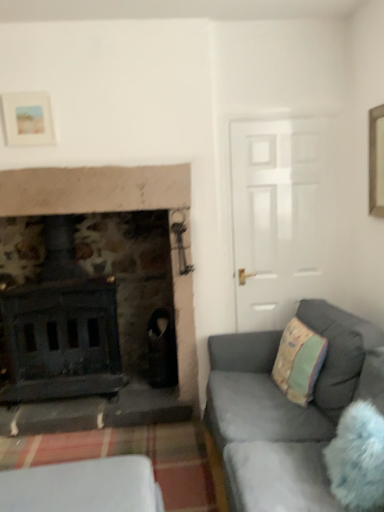
Where is `matte white picture frame at upper left`? This screenshot has width=384, height=512. matte white picture frame at upper left is located at coordinates [27, 119].

What is the approximate width of velvet grey couch at lower right?

It is 86.02 centimeters.

This screenshot has height=512, width=384. What do you see at coordinates (299, 361) in the screenshot?
I see `pastel green fabric pillow at right` at bounding box center [299, 361].

The height and width of the screenshot is (512, 384). Describe the element at coordinates (357, 457) in the screenshot. I see `fluffy white pillow at lower right` at that location.

Describe the element at coordinates (83, 487) in the screenshot. This screenshot has height=512, width=384. I see `white plastic container at lower left` at that location.

I want to click on matte white picture frame at upper left, so click(27, 119).

Is matte white picture frame at upper left inside or outside of fluffy white pillow at lower right?

matte white picture frame at upper left is located beyond the bounds of fluffy white pillow at lower right.

Consider the image. Is matte white picture frame at upper left facing towards fluffy white pillow at lower right?

No.

In order to click on picture frame that appears behind the fluffy white pillow at lower right in this screenshot , I will do `click(27, 119)`.

Considering the positions of point (35, 114) and point (341, 459), is point (35, 114) closer or farther from the camera than point (341, 459)?

Point (35, 114) is positioned farther from the camera compared to point (341, 459).

Is fluffy white pillow at lower right not inside white plastic container at lower left?

Yes, fluffy white pillow at lower right is not within white plastic container at lower left.

In terms of height, does fluffy white pillow at lower right look taller or shorter compared to white plastic container at lower left?

Clearly, fluffy white pillow at lower right is taller compared to white plastic container at lower left.

In the scene shown: Could you tell me if fluffy white pillow at lower right is facing white plastic container at lower left?

Yes, fluffy white pillow at lower right faces towards white plastic container at lower left.

Which object is positioned more to the left, fluffy white pillow at lower right or white plastic container at lower left?

white plastic container at lower left is more to the left.

Based on the photo, from a real-world perspective, is pastel green fabric pillow at right on top of fluffy white pillow at lower right?

Yes.

Where is `pillow to the right of pastel green fabric pillow at right`? pillow to the right of pastel green fabric pillow at right is located at coordinates (357, 457).

Between pastel green fabric pillow at right and fluffy white pillow at lower right, which one has larger size?

pastel green fabric pillow at right is bigger.

From a real-world perspective, is matte white picture frame at upper left under pastel green fabric pillow at right?

No, from a real-world perspective, matte white picture frame at upper left is not beneath pastel green fabric pillow at right.

Does point (23, 138) come behind point (290, 400)?

Yes, it is.

Is matte white picture frame at upper left not inside pastel green fabric pillow at right?

Yes, matte white picture frame at upper left is not within pastel green fabric pillow at right.

From the image's perspective, between matte white picture frame at upper left and pastel green fabric pillow at right, which one is located above?

matte white picture frame at upper left appears higher in the image.

This screenshot has height=512, width=384. Identify the location of pillow above the velvet grey couch at lower right (from a real-world perspective). (x=357, y=457).

From the image's perspective, between velvet grey couch at lower right and fluffy white pillow at lower right, which one is located above?

fluffy white pillow at lower right, from the image's perspective.

From a real-world perspective, which object rests below the other?

velvet grey couch at lower right.

Is velvet grey couch at lower right facing away from fluffy white pillow at lower right?

Yes, velvet grey couch at lower right is facing away from fluffy white pillow at lower right.

Which object is more forward, white plastic container at lower left or pastel green fabric pillow at right?

white plastic container at lower left is more forward.

Is white plastic container at lower left to the right of pastel green fabric pillow at right from the viewer's perspective?

Incorrect, white plastic container at lower left is not on the right side of pastel green fabric pillow at right.

How much distance is there between white plastic container at lower left and pastel green fabric pillow at right?

white plastic container at lower left and pastel green fabric pillow at right are 3.38 feet apart.

Considering the relative sizes of velvet grey couch at lower right and white plastic container at lower left in the image provided, is velvet grey couch at lower right taller than white plastic container at lower left?

Yes.

Is velvet grey couch at lower right to the left or to the right of white plastic container at lower left in the image?

velvet grey couch at lower right is positioned on white plastic container at lower left's right side.

Which object is wider, velvet grey couch at lower right or white plastic container at lower left?

With larger width is velvet grey couch at lower right.

Can you tell me how much velvet grey couch at lower right and white plastic container at lower left differ in facing direction?

87.4 degrees separate the facing orientations of velvet grey couch at lower right and white plastic container at lower left.

Image resolution: width=384 pixels, height=512 pixels. I want to click on pillow below the matte white picture frame at upper left (from a real-world perspective), so click(357, 457).

Where is `pillow above the white plastic container at lower left (from a real-world perspective)`? Image resolution: width=384 pixels, height=512 pixels. pillow above the white plastic container at lower left (from a real-world perspective) is located at coordinates (357, 457).

Which object lies nearer to the anchor point fluffy white pillow at lower right, white plastic container at lower left or velvet grey couch at lower right?

velvet grey couch at lower right is closer to fluffy white pillow at lower right.

Which object lies further to the anchor point velvet grey couch at lower right, white plastic container at lower left or matte white picture frame at upper left?

Among the two, matte white picture frame at upper left is located further to velvet grey couch at lower right.

From the picture: Considering their positions, is fluffy white pillow at lower right positioned closer to white plastic container at lower left than matte white picture frame at upper left?

fluffy white pillow at lower right.

When comparing their distances from velvet grey couch at lower right, does matte white picture frame at upper left or fluffy white pillow at lower right seem closer?

fluffy white pillow at lower right is closer to velvet grey couch at lower right.

Estimate the real-world distances between objects in this image. Which object is further from fluffy white pillow at lower right, matte white picture frame at upper left or velvet grey couch at lower right?

matte white picture frame at upper left is further to fluffy white pillow at lower right.

Looking at the image, which one is located further to white plastic container at lower left, matte white picture frame at upper left or velvet grey couch at lower right?

matte white picture frame at upper left is positioned further to the anchor white plastic container at lower left.

When comparing their distances from fluffy white pillow at lower right, does velvet grey couch at lower right or pastel green fabric pillow at right seem further?

pastel green fabric pillow at right is further to fluffy white pillow at lower right.

Based on their spatial positions, is matte white picture frame at upper left or pastel green fabric pillow at right further from white plastic container at lower left?

Among the two, matte white picture frame at upper left is located further to white plastic container at lower left.

The width and height of the screenshot is (384, 512). I want to click on studio couch between matte white picture frame at upper left and white plastic container at lower left in the up-down direction, so click(x=285, y=411).

Find the location of a particular element. The width and height of the screenshot is (384, 512). throw pillow located between matte white picture frame at upper left and fluffy white pillow at lower right in the left-right direction is located at coordinates coord(299,361).

Where is `throw pillow located between white plastic container at lower left and fluffy white pillow at lower right in the left-right direction`? The image size is (384, 512). throw pillow located between white plastic container at lower left and fluffy white pillow at lower right in the left-right direction is located at coordinates (299, 361).

This screenshot has width=384, height=512. What are the coordinates of `pillow between velvet grey couch at lower right and pastel green fabric pillow at right from front to back` in the screenshot? It's located at (357, 457).